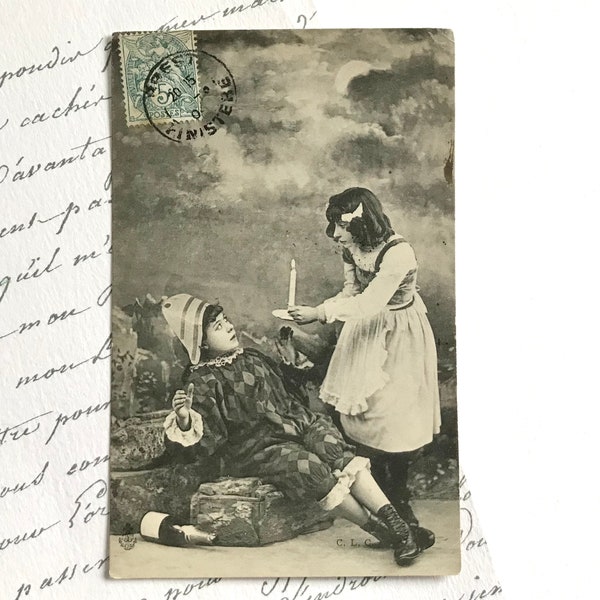
Locate an element on the screen. wine bottle is located at coordinates (160, 535).